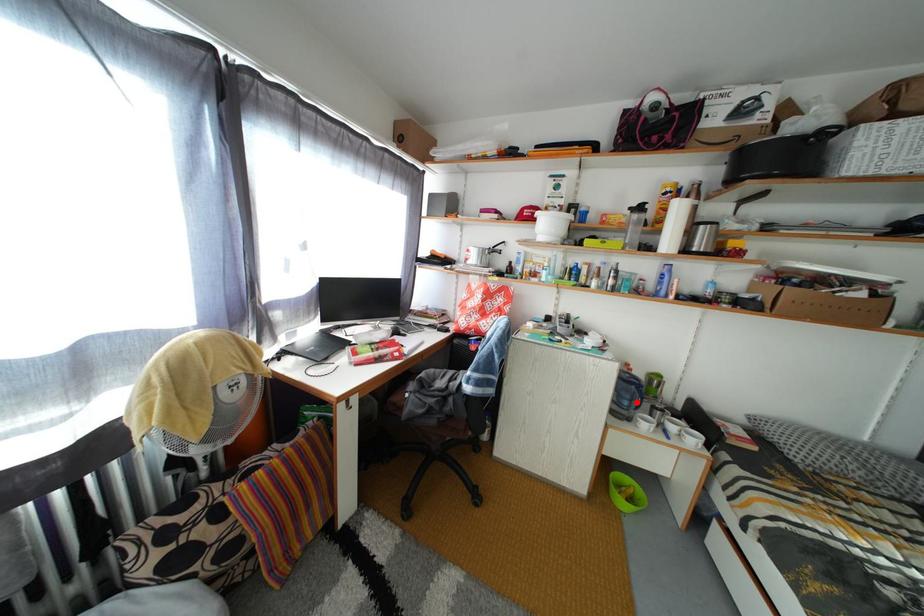
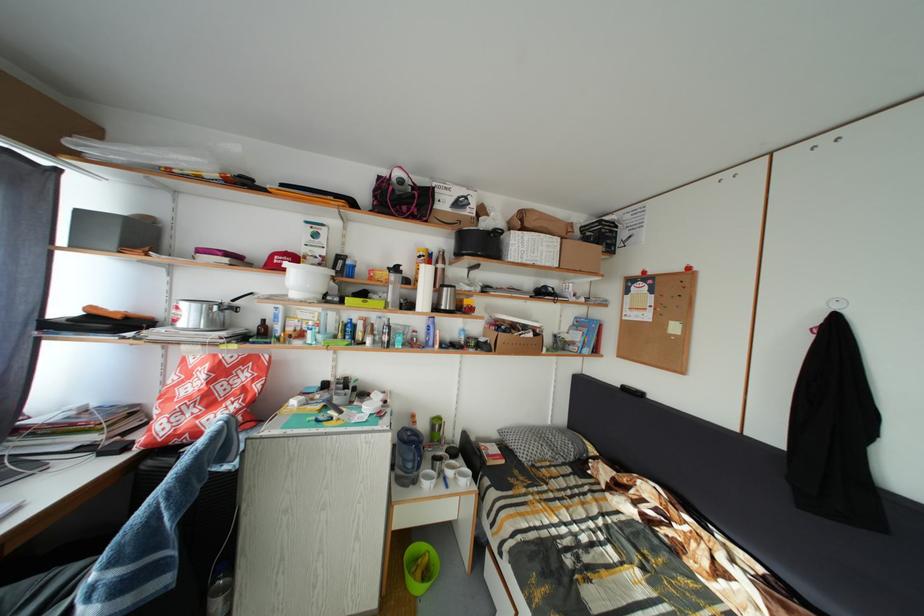
Find the pixel in the second image that matches the highlighted location in the first image.

(419, 464)